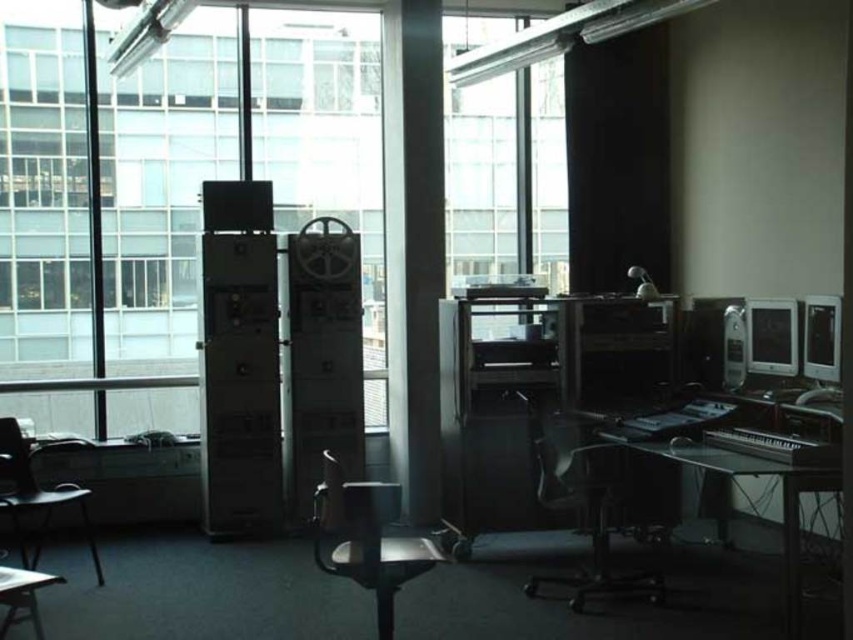
Question: Which point is closer to the camera taking this photo?

Choices:
 (A) (534, 154)
 (B) (35, 506)
 (C) (840, 317)
 (D) (526, 595)

Answer: (C)

Question: Estimate the real-world distances between objects in this image. Which object is farther from the transparent glass window at center?

Choices:
 (A) transparent glass window at upper center
 (B) transparent plastic swivel chair at center
 (C) metallic silver swivel chair at center
 (D) metallic silver speaker at right

Answer: (C)

Question: Where is metallic silver swivel chair at center located in relation to matte black monitor at right in the image?

Choices:
 (A) left
 (B) right

Answer: (A)

Question: Can you confirm if metallic silver swivel chair at center is wider than black glass table at lower right?

Choices:
 (A) yes
 (B) no

Answer: (B)

Question: Does transparent plastic swivel chair at center lie behind metallic silver speaker at right?

Choices:
 (A) no
 (B) yes

Answer: (A)

Question: Which point is closer to the camera?

Choices:
 (A) (770, 349)
 (B) (576, 493)
 (C) (454, 141)
 (D) (80, 509)

Answer: (B)